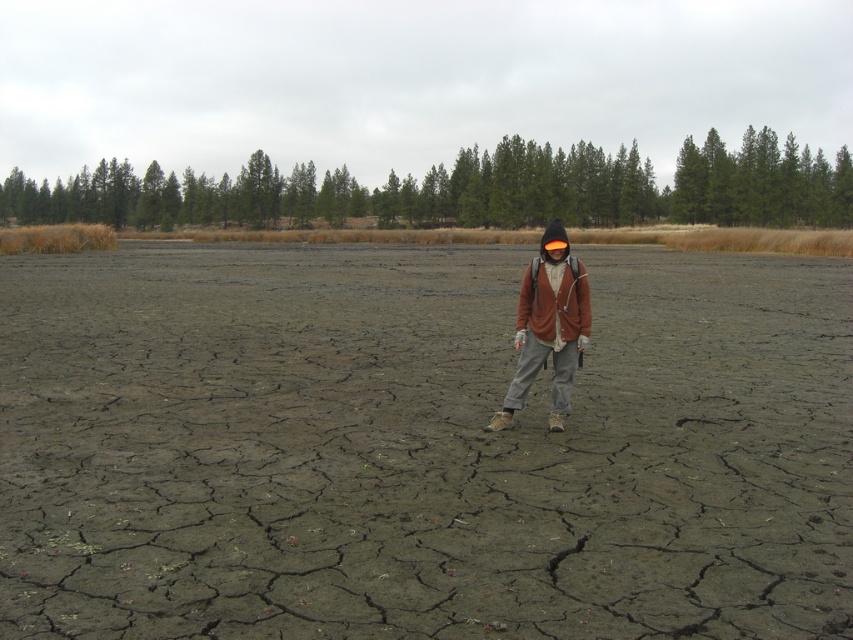
You are a hiker who has just arrived at this dry landscape. You notice the dull gray mud at center and the brown soft jacket at center. Which object is located to the right of the other?

The dull gray mud at center is positioned on the right side of brown soft jacket at center, so the dull gray mud at center is to the right of the brown soft jacket at center.

You are a hiker trying to cross the cracked earth landscape. You notice the dull gray mud at center and the brown soft jacket at center. Which object is larger in size?

The dull gray mud at center is bigger than the brown soft jacket at center, so the dull gray mud at center is larger in size.